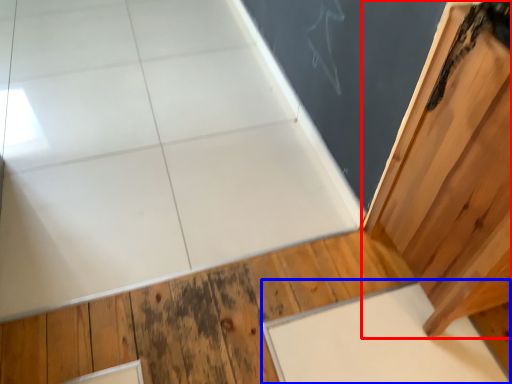
Question: Which point is closer to the camera, door (highlighted by a red box) or slate (highlighted by a blue box)?

Choices:
 (A) door
 (B) slate

Answer: (A)